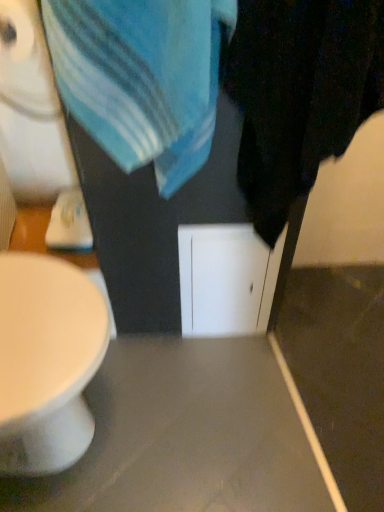
Identify the location of black matte towel at right. (299, 93).

Describe the element at coordinates (25, 60) in the screenshot. I see `white paper at upper left` at that location.

At what (x,y) coordinates should I click in order to perform the action: click on black matte towel at right. Please return your answer as a coordinate pair (x, y). Looking at the image, I should click on (299, 93).

In the image, is white paper at upper left positioned in front of or behind blue cotton towel at upper center?

Visually, white paper at upper left is located behind blue cotton towel at upper center.

From the image's perspective, is white paper at upper left positioned above or below blue cotton towel at upper center?

white paper at upper left is situated higher than blue cotton towel at upper center in the image.

Measure the distance between white paper at upper left and blue cotton towel at upper center.

13.48 inches.

You are a GUI agent. You are given a task and a screenshot of the screen. Output one action in this format:
    pyautogui.click(x=<x>, y=<y>)
    Task: Click on the toilet paper in front of the matte gray table at center
    This screenshot has height=512, width=384.
    Given the screenshot: What is the action you would take?
    pyautogui.click(x=25, y=60)

Does point (28, 10) appear closer or farther from the camera than point (192, 482)?

Point (28, 10) is positioned closer to the camera compared to point (192, 482).

From the picture: Is white paper at upper left smaller than matte gray table at center?

Correct, white paper at upper left occupies less space than matte gray table at center.

How many degrees apart are the facing directions of white paper at upper left and matte gray table at center?

They differ by 2.27 degrees in their facing directions.

Are blue cotton towel at upper center and black matte towel at right far apart?

No.

In terms of height, does blue cotton towel at upper center look taller or shorter compared to black matte towel at right?

Considering their sizes, blue cotton towel at upper center has less height than black matte towel at right.

Does point (205, 40) come farther from viewer compared to point (259, 120)?

No, (205, 40) is closer to viewer.

Which is closer, (120, 106) or (250, 463)?

Positioned in front is point (120, 106).

You are a GUI agent. You are given a task and a screenshot of the screen. Output one action in this format:
    pyautogui.click(x=<x>, y=<y>)
    Task: Click on the table below the blue cotton towel at upper center (from the image's perspective)
    The height and width of the screenshot is (512, 384).
    Given the screenshot: What is the action you would take?
    pyautogui.click(x=189, y=436)

From the image's perspective, which one is positioned lower, blue cotton towel at upper center or matte gray table at center?

From the image's view, matte gray table at center is below.

In terms of width, does blue cotton towel at upper center look wider or thinner when compared to matte gray table at center?

Clearly, blue cotton towel at upper center has less width compared to matte gray table at center.

Considering the relative sizes of matte gray table at center and blue cotton towel at upper center in the image provided, is matte gray table at center taller than blue cotton towel at upper center?

No, matte gray table at center is not taller than blue cotton towel at upper center.

Consider the image. Can you confirm if matte gray table at center is positioned to the left of blue cotton towel at upper center?

In fact, matte gray table at center is to the right of blue cotton towel at upper center.

Based on the photo, from the image's perspective, which is above, matte gray table at center or blue cotton towel at upper center?

blue cotton towel at upper center appears higher in the image.

What are the coordinates of `beach towel above the matte gray table at center (from a real-world perspective)` in the screenshot? It's located at 140,79.

From a real-world perspective, is white paper at upper left positioned under black matte towel at right based on gravity?

Incorrect, from a real-world perspective, white paper at upper left is higher than black matte towel at right.

Does white paper at upper left turn towards black matte towel at right?

No, white paper at upper left is not oriented towards black matte towel at right.

Who is smaller, white paper at upper left or black matte towel at right?

white paper at upper left is smaller.

Consider the image. From the image's perspective, who appears lower, white paper at upper left or black matte towel at right?

black matte towel at right is shown below in the image.

From a real-world perspective, which is physically above, black matte towel at right or white paper at upper left?

In real-world perspective, white paper at upper left is above.

Is point (266, 46) positioned behind point (8, 26)?

No, (266, 46) is closer to viewer.

From the image's perspective, is black matte towel at right positioned above or below white paper at upper left?

From the image's perspective, black matte towel at right appears below white paper at upper left.

Can you confirm if black matte towel at right is positioned to the left of white paper at upper left?

Incorrect, black matte towel at right is not on the left side of white paper at upper left.

The image size is (384, 512). What are the coordinates of `beach towel in front of the white paper at upper left` in the screenshot? It's located at (140, 79).

You are a GUI agent. You are given a task and a screenshot of the screen. Output one action in this format:
    pyautogui.click(x=<x>, y=<y>)
    Task: Click on the table below the white paper at upper left (from the image's perspective)
    Image resolution: width=384 pixels, height=512 pixels.
    Given the screenshot: What is the action you would take?
    pyautogui.click(x=189, y=436)

When comparing their distances from black matte towel at right, does blue cotton towel at upper center or white paper at upper left seem further?

white paper at upper left.

Based on their spatial positions, is blue cotton towel at upper center or black matte towel at right closer to matte gray table at center?

black matte towel at right is positioned closer to the anchor matte gray table at center.

Looking at the image, which one is located closer to blue cotton towel at upper center, matte gray table at center or white paper at upper left?

Among the two, white paper at upper left is located nearer to blue cotton towel at upper center.

Considering their positions, is matte gray table at center positioned closer to white paper at upper left than black matte towel at right?

black matte towel at right is closer to white paper at upper left.

Considering their positions, is black matte towel at right positioned closer to matte gray table at center than white paper at upper left?

The object closer to matte gray table at center is black matte towel at right.

Consider the image. Looking at the image, which one is located closer to white paper at upper left, matte gray table at center or blue cotton towel at upper center?

blue cotton towel at upper center.

Based on their spatial positions, is white paper at upper left or black matte towel at right closer to blue cotton towel at upper center?

Among the two, black matte towel at right is located nearer to blue cotton towel at upper center.

From the picture: Which object lies further to the anchor point white paper at upper left, black matte towel at right or blue cotton towel at upper center?

black matte towel at right is positioned further to the anchor white paper at upper left.

Identify the location of beach towel between white paper at upper left and black matte towel at right in the horizontal direction. The image size is (384, 512). (140, 79).

Where is `bath towel between blue cotton towel at upper center and matte gray table at center from top to bottom`? bath towel between blue cotton towel at upper center and matte gray table at center from top to bottom is located at coordinates (299, 93).

The image size is (384, 512). I want to click on beach towel that lies between white paper at upper left and matte gray table at center from top to bottom, so click(140, 79).

Identify the location of bath towel that lies between white paper at upper left and matte gray table at center from top to bottom. (299, 93).